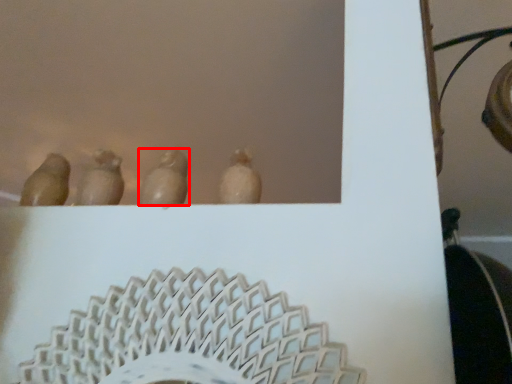
Question: From the image's perspective, where is animal (annotated by the red box) located relative to animal?

Choices:
 (A) below
 (B) above

Answer: (B)